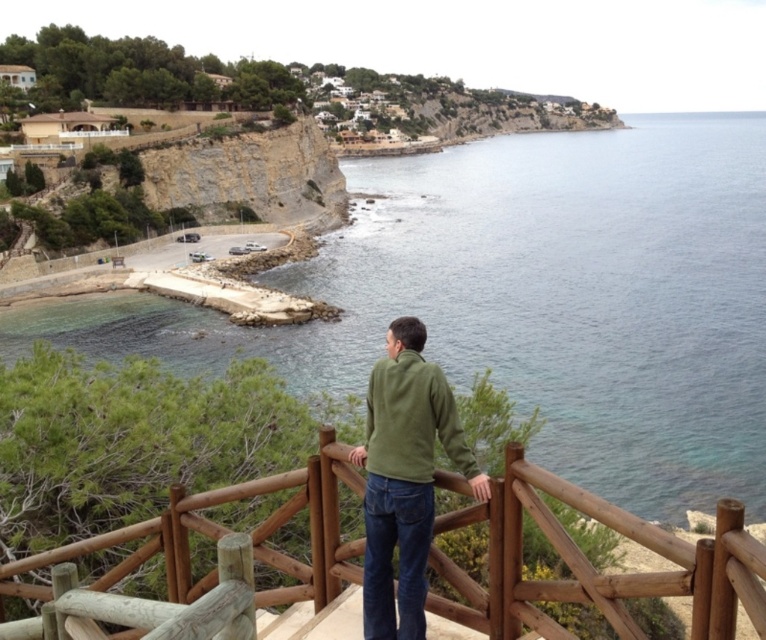
Question: Which point is closer to the camera?

Choices:
 (A) (408, 355)
 (B) (496, 481)
 (C) (411, 442)

Answer: (B)

Question: Is green fleece jacket at center to the right of green fleece sweatshirt at center from the viewer's perspective?

Choices:
 (A) no
 (B) yes

Answer: (A)

Question: Which point is closer to the camera?

Choices:
 (A) green fleece jacket at center
 (B) wooden at center
 (C) green fleece sweatshirt at center

Answer: (B)

Question: Which point is closer to the camera?

Choices:
 (A) (368, 637)
 (B) (390, 390)

Answer: (A)

Question: Can you confirm if wooden at center is thinner than green fleece jacket at center?

Choices:
 (A) yes
 (B) no

Answer: (B)

Question: In this image, where is green fleece jacket at center located relative to green fleece sweatshirt at center?

Choices:
 (A) below
 (B) above

Answer: (A)